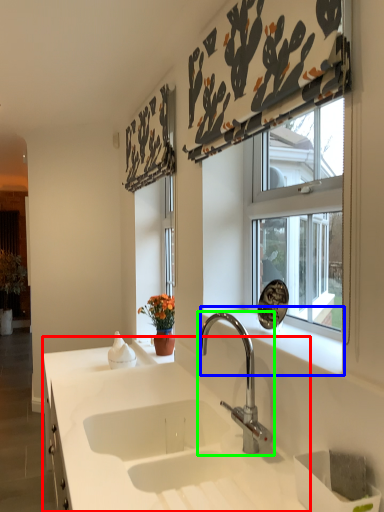
Question: Which object is the closest to the countertop (highlighted by a red box)? Choose among these: window sill (highlighted by a blue box) or tap (highlighted by a green box).

Choices:
 (A) window sill
 (B) tap

Answer: (B)